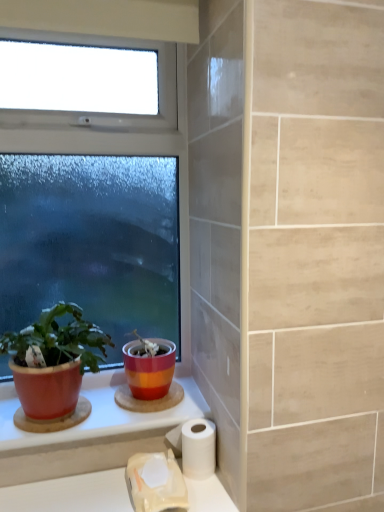
The height and width of the screenshot is (512, 384). Describe the element at coordinates (53, 360) in the screenshot. I see `matte red pot at left` at that location.

Locate an element on the screen. The image size is (384, 512). matte red pot at left is located at coordinates (53, 360).

Looking at this image, between matte ceramic counter top at lower left and white matte toilet paper at lower center, arranged as the 2th toilet paper when viewed from the left, which one has more height?

white matte toilet paper at lower center, arranged as the 2th toilet paper when viewed from the left.

From a real-world perspective, which toilet paper is the 1st one underneath the matte ceramic counter top at lower left? Please provide its 2D coordinates.

[(198, 448)]

Between matte ceramic counter top at lower left and white matte toilet paper at lower center, acting as the 1th toilet paper starting from the right, which one is positioned in front?

matte ceramic counter top at lower left is closer to the camera.

What's the angular difference between matte ceramic counter top at lower left and white matte toilet paper at lower center, arranged as the 2th toilet paper when viewed from the left,'s facing directions?

There is a 1.3-degree angle between the facing directions of matte ceramic counter top at lower left and white matte toilet paper at lower center, arranged as the 2th toilet paper when viewed from the left.

Is matte ceramic pot at center outside of white matte toilet paper at lower center, acting as the 1th toilet paper starting from the right?

matte ceramic pot at center is positioned outside white matte toilet paper at lower center, acting as the 1th toilet paper starting from the right.

Between matte ceramic pot at center and white matte toilet paper at lower center, acting as the 1th toilet paper starting from the right, which one has larger width?

Wider between the two is matte ceramic pot at center.

Between matte ceramic pot at center and white matte toilet paper at lower center, acting as the 1th toilet paper starting from the right, which one appears on the right side from the viewer's perspective?

From the viewer's perspective, white matte toilet paper at lower center, acting as the 1th toilet paper starting from the right, appears more on the right side.

In terms of height, does matte ceramic pot at center look taller or shorter compared to white matte toilet paper at lower center, arranged as the 2th toilet paper when viewed from the left?

Considering their sizes, matte ceramic pot at center has more height than white matte toilet paper at lower center, arranged as the 2th toilet paper when viewed from the left.

Based on the photo, from the image's perspective, is matte ceramic counter top at lower left under clear glass window at upper left?

Correct, matte ceramic counter top at lower left appears lower than clear glass window at upper left in the image.

Looking at their sizes, would you say matte ceramic counter top at lower left is wider or thinner than clear glass window at upper left?

Considering their sizes, matte ceramic counter top at lower left looks broader than clear glass window at upper left.

The width and height of the screenshot is (384, 512). What are the coordinates of `window above the white matte toilet paper at lower center, acting as the 2th toilet paper starting from the right (from the image's perspective)` in the screenshot? It's located at (130, 154).

Is the depth of white matte toilet paper at lower center, acting as the 2th toilet paper starting from the right, greater than that of clear glass window at upper left?

No.

From the picture: Which is correct: white matte toilet paper at lower center, which ranks as the 1th toilet paper in left-to-right order, is inside clear glass window at upper left, or outside of it?

white matte toilet paper at lower center, which ranks as the 1th toilet paper in left-to-right order, exists outside the volume of clear glass window at upper left.

Does white matte toilet paper at lower center, acting as the 2th toilet paper starting from the right, have a greater width compared to clear glass window at upper left?

Yes.

Does white matte toilet paper at lower center, acting as the 1th toilet paper starting from the right, have a greater height compared to matte ceramic counter top at lower left?

Correct, white matte toilet paper at lower center, acting as the 1th toilet paper starting from the right, is much taller as matte ceramic counter top at lower left.

Which point is more distant from viewer, [196,461] or [5,444]?

The point [196,461] is behind.

Considering the relative sizes of white matte toilet paper at lower center, arranged as the 2th toilet paper when viewed from the left, and matte ceramic counter top at lower left in the image provided, is white matte toilet paper at lower center, arranged as the 2th toilet paper when viewed from the left, bigger than matte ceramic counter top at lower left?

No, white matte toilet paper at lower center, arranged as the 2th toilet paper when viewed from the left, is not bigger than matte ceramic counter top at lower left.

From the image's perspective, which one is positioned lower, white matte toilet paper at lower center, acting as the 1th toilet paper starting from the right, or matte ceramic counter top at lower left?

From the image's view, white matte toilet paper at lower center, acting as the 1th toilet paper starting from the right, is below.

Is matte red pot at left positioned with its back to white matte toilet paper at lower center, arranged as the 2th toilet paper when viewed from the left?

No.

You are a GUI agent. You are given a task and a screenshot of the screen. Output one action in this format:
    pyautogui.click(x=<x>, y=<y>)
    Task: Click on the 1st toilet paper positioned below the matte red pot at left (from the image's perspective)
    This screenshot has width=384, height=512.
    Given the screenshot: What is the action you would take?
    pyautogui.click(x=198, y=448)

Is matte red pot at left at the right side of white matte toilet paper at lower center, arranged as the 2th toilet paper when viewed from the left?

In fact, matte red pot at left is to the left of white matte toilet paper at lower center, arranged as the 2th toilet paper when viewed from the left.

From a real-world perspective, which is physically above, matte red pot at left or white matte toilet paper at lower center, acting as the 1th toilet paper starting from the right?

matte red pot at left is physically above.

Considering the relative sizes of matte red pot at left and clear glass window at upper left in the image provided, is matte red pot at left bigger than clear glass window at upper left?

Incorrect, matte red pot at left is not larger than clear glass window at upper left.

From the image's perspective, which one is positioned lower, matte red pot at left or clear glass window at upper left?

matte red pot at left is shown below in the image.

Is matte red pot at left located outside clear glass window at upper left?

Yes, matte red pot at left is located beyond the bounds of clear glass window at upper left.

From a real-world perspective, is matte red pot at left above or below clear glass window at upper left?

From a real-world perspective, matte red pot at left is physically below clear glass window at upper left.

The height and width of the screenshot is (512, 384). In order to click on the 2nd toilet paper to the right of the matte ceramic counter top at lower left, starting your count from the anchor in this screenshot , I will do `click(198, 448)`.

Identify the location of flowerpot on the left of white matte toilet paper at lower center, acting as the 1th toilet paper starting from the right. click(149, 369).

Estimate the real-world distances between objects in this image. Which object is closer to white matte toilet paper at lower center, arranged as the 2th toilet paper when viewed from the left, matte ceramic counter top at lower left or white matte toilet paper at lower center, acting as the 2th toilet paper starting from the right?

white matte toilet paper at lower center, acting as the 2th toilet paper starting from the right, is closer to white matte toilet paper at lower center, arranged as the 2th toilet paper when viewed from the left.

Considering their positions, is white matte toilet paper at lower center, acting as the 2th toilet paper starting from the right, positioned further to white matte toilet paper at lower center, arranged as the 2th toilet paper when viewed from the left, than matte red pot at left?

matte red pot at left lies further to white matte toilet paper at lower center, arranged as the 2th toilet paper when viewed from the left, than the other object.

Estimate the real-world distances between objects in this image. Which object is further from white matte toilet paper at lower center, arranged as the 2th toilet paper when viewed from the left, matte red pot at left or clear glass window at upper left?

clear glass window at upper left lies further to white matte toilet paper at lower center, arranged as the 2th toilet paper when viewed from the left, than the other object.

Based on their spatial positions, is white matte toilet paper at lower center, arranged as the 2th toilet paper when viewed from the left, or matte ceramic counter top at lower left further from matte red pot at left?

The object further to matte red pot at left is white matte toilet paper at lower center, arranged as the 2th toilet paper when viewed from the left.

Based on the photo, looking at the image, which one is located closer to matte ceramic pot at center, white matte toilet paper at lower center, arranged as the 2th toilet paper when viewed from the left, or matte red pot at left?

Based on the image, white matte toilet paper at lower center, arranged as the 2th toilet paper when viewed from the left, appears to be nearer to matte ceramic pot at center.

Considering their positions, is clear glass window at upper left positioned closer to matte ceramic pot at center than white matte toilet paper at lower center, which ranks as the 1th toilet paper in left-to-right order?

white matte toilet paper at lower center, which ranks as the 1th toilet paper in left-to-right order, lies closer to matte ceramic pot at center than the other object.

Based on the photo, considering their positions, is clear glass window at upper left positioned closer to white matte toilet paper at lower center, which ranks as the 1th toilet paper in left-to-right order, than white matte toilet paper at lower center, arranged as the 2th toilet paper when viewed from the left?

white matte toilet paper at lower center, arranged as the 2th toilet paper when viewed from the left, lies closer to white matte toilet paper at lower center, which ranks as the 1th toilet paper in left-to-right order, than the other object.

From the image, which object appears to be nearer to matte ceramic pot at center, clear glass window at upper left or matte red pot at left?

matte red pot at left is closer to matte ceramic pot at center.

Locate an element on the screen. The width and height of the screenshot is (384, 512). flowerpot between matte red pot at left and white matte toilet paper at lower center, arranged as the 2th toilet paper when viewed from the left, from left to right is located at coordinates (149, 369).

This screenshot has width=384, height=512. I want to click on flowerpot between clear glass window at upper left and white matte toilet paper at lower center, acting as the 1th toilet paper starting from the right, in the vertical direction, so click(x=149, y=369).

Find the location of a particular element. The height and width of the screenshot is (512, 384). houseplant that lies between clear glass window at upper left and white matte toilet paper at lower center, acting as the 2th toilet paper starting from the right, from top to bottom is located at coordinates (53, 360).

Locate an element on the screen. This screenshot has width=384, height=512. counter top that lies between clear glass window at upper left and white matte toilet paper at lower center, which ranks as the 1th toilet paper in left-to-right order, from top to bottom is located at coordinates (90, 437).